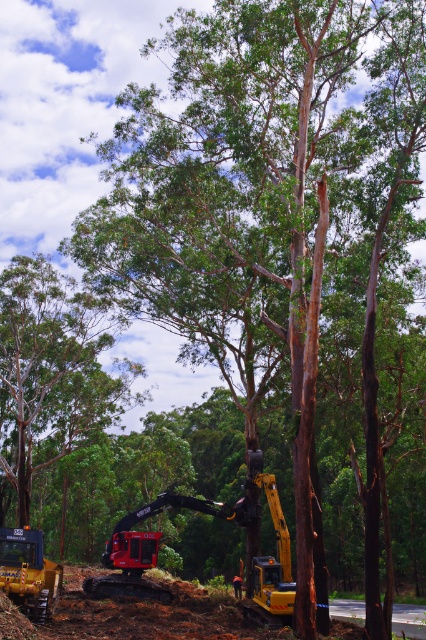
Question: Which point is farther to the camera?

Choices:
 (A) (17, 602)
 (B) (16, 339)

Answer: (B)

Question: Which point is farther from the camera taking this photo?

Choices:
 (A) (31, 580)
 (B) (0, 432)

Answer: (B)

Question: Can you confirm if green rough bark tree at upper left is positioned below yellow rubber tracked excavator at lower left?

Choices:
 (A) no
 (B) yes

Answer: (A)

Question: Is green rough bark tree at upper left thinner than yellow rubber tracked excavator at lower left?

Choices:
 (A) no
 (B) yes

Answer: (A)

Question: Where is green rough bark tree at upper left located in relation to yellow rubber tracked excavator at lower left in the image?

Choices:
 (A) right
 (B) left

Answer: (B)